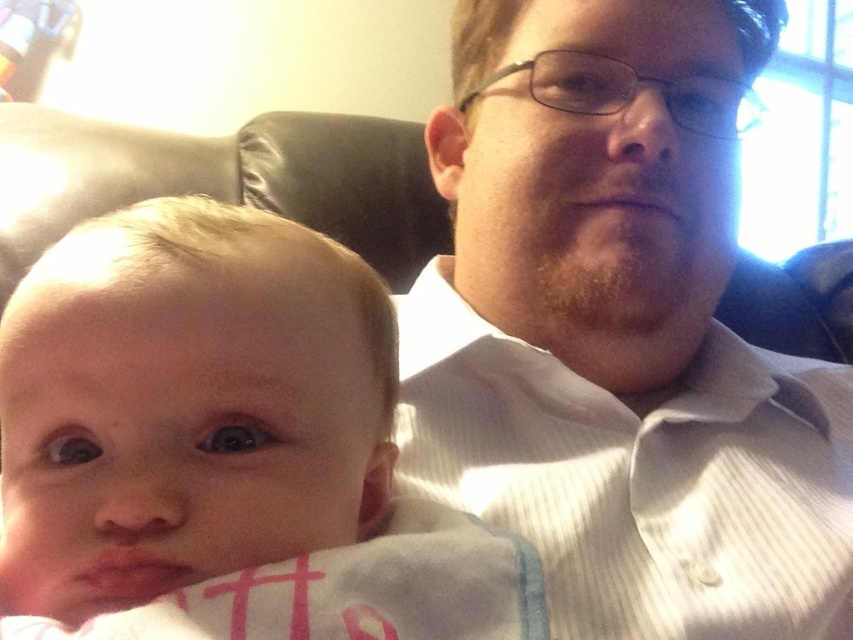
Question: Is white striped shirt at upper right above smooth skin baby at center?

Choices:
 (A) yes
 (B) no

Answer: (A)

Question: Among these objects, which one is nearest to the camera?

Choices:
 (A) smooth skin baby at center
 (B) white striped shirt at upper right

Answer: (A)

Question: Which point is farther from the camera taking this photo?

Choices:
 (A) coord(672,42)
 (B) coord(234,616)

Answer: (A)

Question: Does white striped shirt at upper right appear on the right side of smooth skin baby at center?

Choices:
 (A) yes
 (B) no

Answer: (A)

Question: Among these points, which one is nearest to the camera?

Choices:
 (A) (734, 353)
 (B) (184, 429)

Answer: (B)

Question: Does white striped shirt at upper right appear under smooth skin baby at center?

Choices:
 (A) no
 (B) yes

Answer: (A)